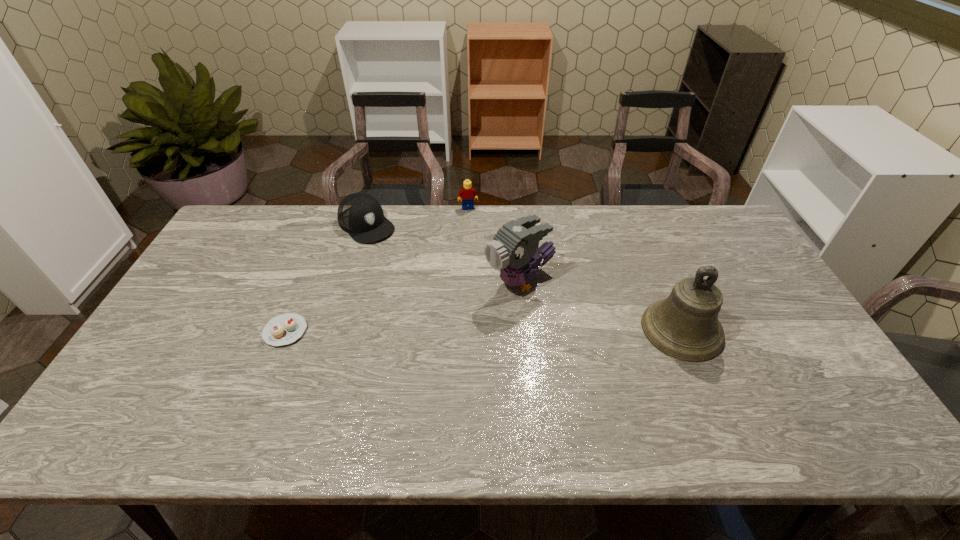
Identify the location of free space located 0.300m at the beak of the second object from right to left. (404, 347).

Where is `free space located at the beak of the second object from right to left`? free space located at the beak of the second object from right to left is located at coordinates (456, 317).

Image resolution: width=960 pixels, height=540 pixels. I want to click on blank space located 0.350m at the beak of the second object from right to left, so click(x=388, y=356).

The image size is (960, 540). Find the location of `vacant space located on the front-facing side of the cap`. vacant space located on the front-facing side of the cap is located at coordinates (444, 306).

Identify the location of vacant position located on the front-facing side of the cap. The width and height of the screenshot is (960, 540). (404, 264).

The image size is (960, 540). Find the location of `free space located 0.360m on the front-facing side of the cap`. free space located 0.360m on the front-facing side of the cap is located at coordinates (441, 302).

The height and width of the screenshot is (540, 960). Identify the location of Lego at the far edge. (468, 194).

The height and width of the screenshot is (540, 960). Find the location of `cap that is positioned at the far edge`. cap that is positioned at the far edge is located at coordinates (361, 215).

Image resolution: width=960 pixels, height=540 pixels. Identify the location of free space at the far edge. (568, 216).

I want to click on vacant space at the left edge of the desktop, so click(x=186, y=336).